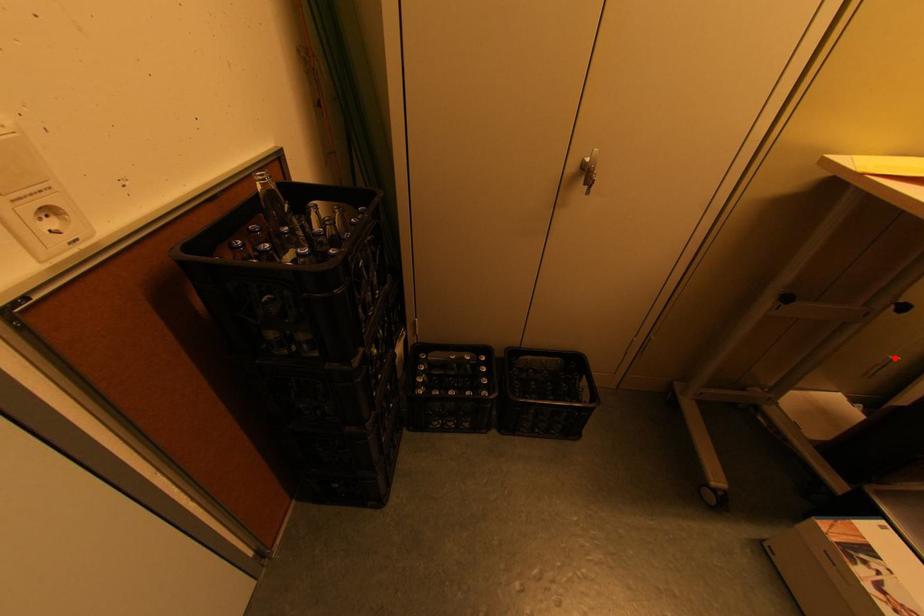
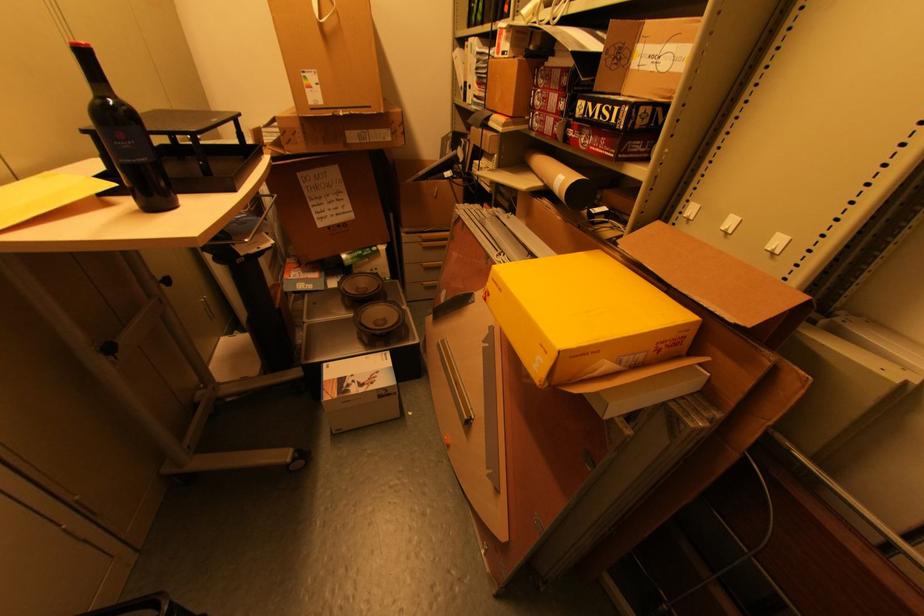
In the second image, find the point that corresponds to the highlighted location in the first image.

(207, 301)